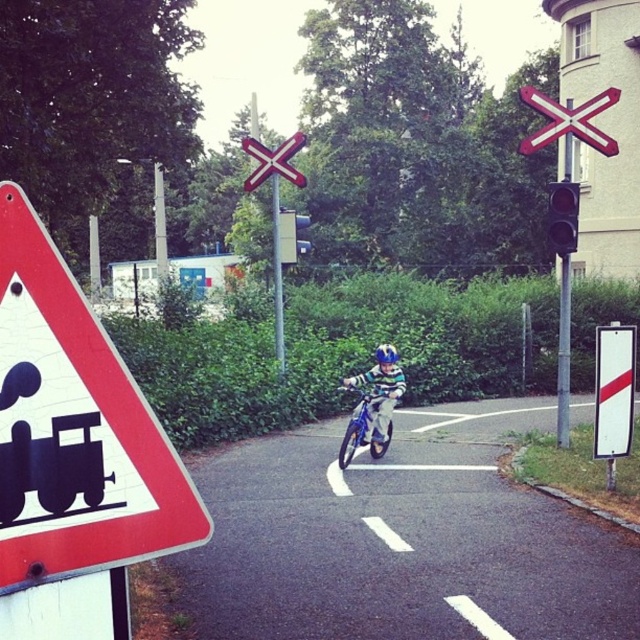
You are a pedestrian standing at the edge of the road. You see a brushed metal railroad crossing sign at upper center and a metallic silver dirt bike at center. Which object is positioned to the right side of the other?

The brushed metal railroad crossing sign at upper center is to the right of the metallic silver dirt bike at center.

You are a pedestrian standing at the railway crossing and see a metallic silver bicycle at center and a metallic silver dirt bike at center. Which one is closer to the ground?

The metallic silver dirt bike at center is closer to the ground because the metallic silver bicycle at center is above it.

You are a driver approaching the railway crossing and see both the green glass traffic light at right and the metallic traffic light at center. Which traffic light is located to the right side of the other?

The green glass traffic light at right is positioned on the right side of metallic traffic light at center.